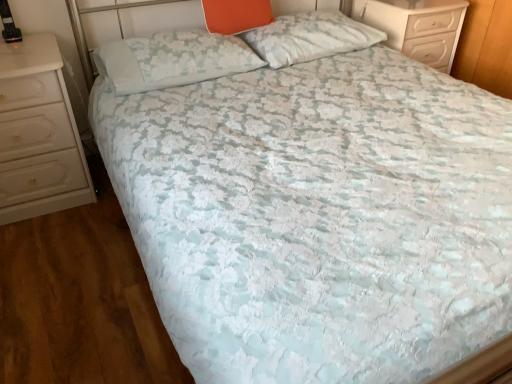
Question: Is point (199, 31) closer or farther from the camera than point (254, 23)?

Choices:
 (A) farther
 (B) closer

Answer: (A)

Question: Is white textured pillow at upper center, which is counted as the 3th pillow, starting from the right, bigger or smaller than orange fabric pillow at upper center, which is the 2th pillow in right-to-left order?

Choices:
 (A) big
 (B) small

Answer: (A)

Question: Which object is positioned closest to the white glossy chest of drawers at left, placed as the first chest of drawers when sorted from bottom to top?

Choices:
 (A) orange fabric pillow at upper center, which is the 2th pillow in right-to-left order
 (B) white textured pillow at upper center, which is counted as the 3th pillow, starting from the right
 (C) white glossy chest of drawers at upper right, arranged as the first chest of drawers when viewed from the right
 (D) white textured pillow at upper center, the 3th pillow viewed from the left

Answer: (B)

Question: Estimate the real-world distances between objects in this image. Which object is closer to the white textured pillow at upper center, the 3th pillow viewed from the left?

Choices:
 (A) white glossy chest of drawers at upper right, marked as the 2th chest of drawers in a bottom-to-top arrangement
 (B) white textured pillow at upper center, which is counted as the 3th pillow, starting from the right
 (C) orange fabric pillow at upper center, arranged as the 2th pillow when viewed from the left
 (D) white glossy chest of drawers at left, positioned as the second chest of drawers in right-to-left order

Answer: (C)